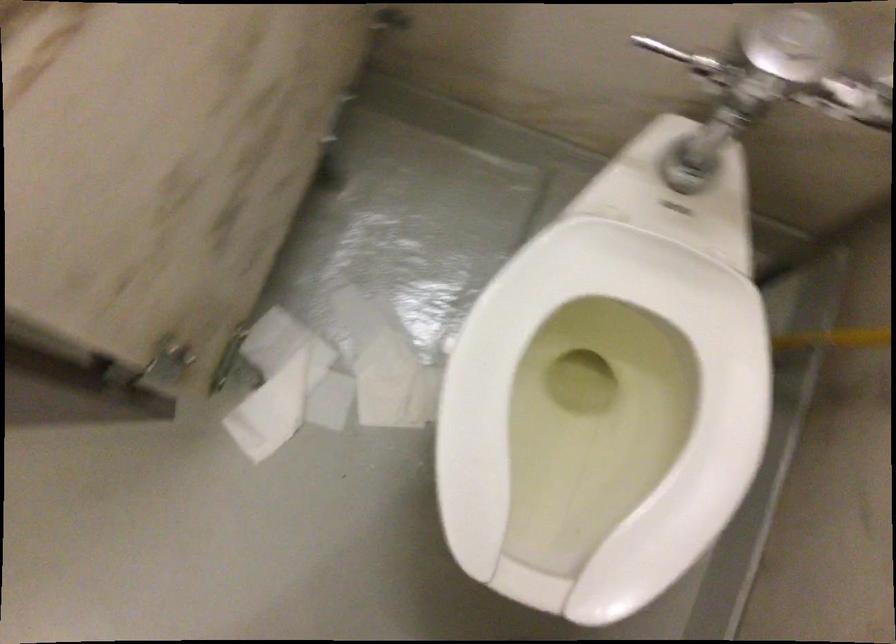
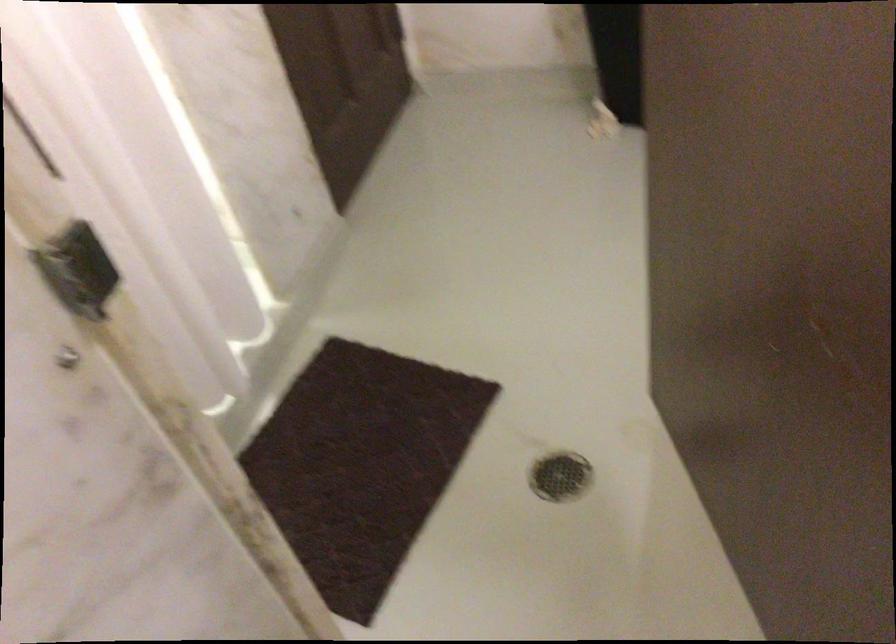
Question: The images are taken continuously from a first-person perspective. In which direction is your viewpoint rotating?

Choices:
 (A) Left
 (B) Right
 (C) Up
 (D) Down

Answer: (A)